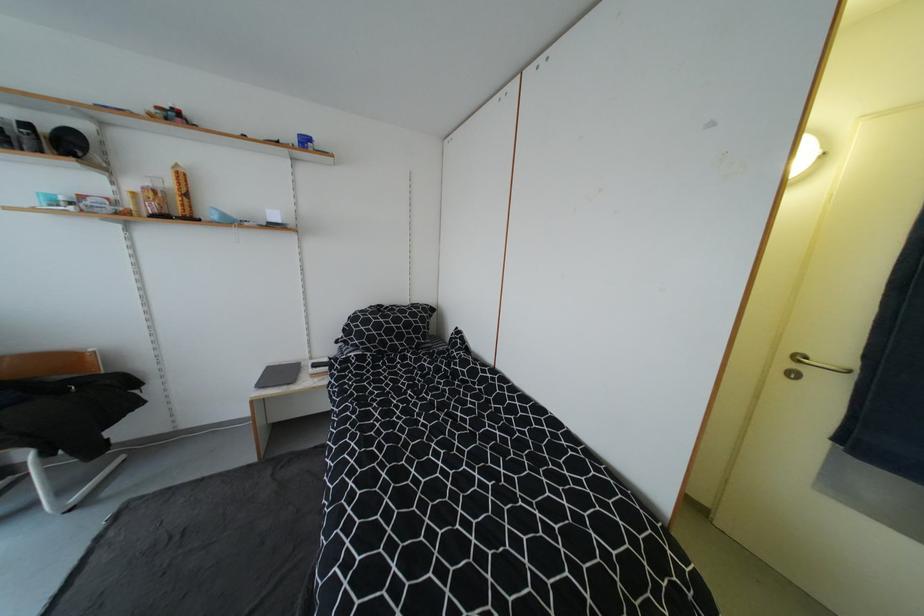
Find where to turn the silver door handle. Please return your answer as a coordinate pair (x, y).

(816, 365)